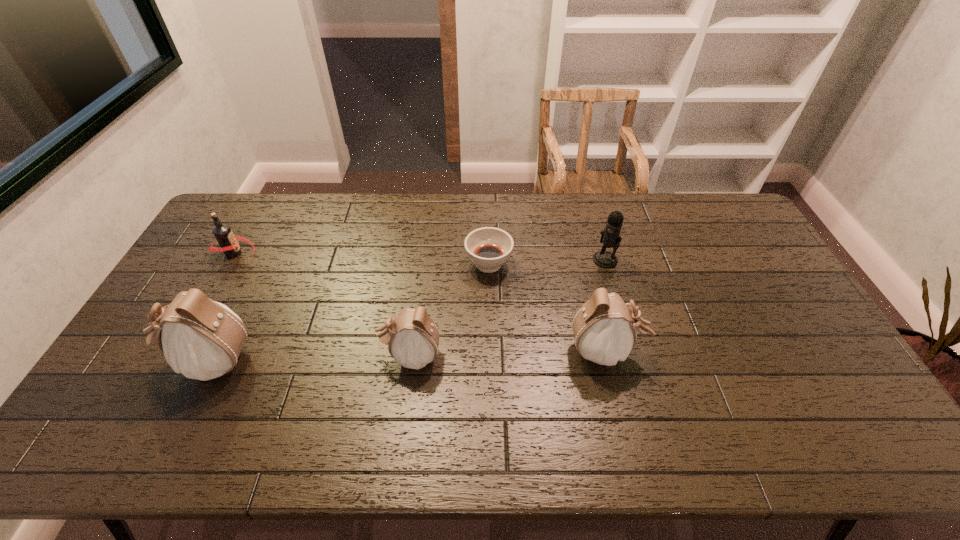
Image resolution: width=960 pixels, height=540 pixels. What are the coordinates of `vacant area situated on the front-facing side of the fourth object from right to left` in the screenshot? It's located at (258, 356).

Find the location of `free space located 0.180m on the front-facing side of the fourth object from right to left`. free space located 0.180m on the front-facing side of the fourth object from right to left is located at coordinates (313, 356).

This screenshot has height=540, width=960. Identify the location of vacant space positioned on the front-facing side of the fourth object from right to left. (266, 356).

Locate an element on the screen. The width and height of the screenshot is (960, 540). blank space located on the front-facing side of the second shortest pouch is located at coordinates (705, 351).

This screenshot has width=960, height=540. In order to click on vacant space located 0.100m on the front of the microphone in this screenshot , I will do `click(613, 291)`.

Identify the location of blank space located on the right of the shortest object. (579, 264).

Find the location of a particular element. Image resolution: width=960 pixels, height=540 pixels. vacant region located on the label of the root beer is located at coordinates (286, 253).

Where is `object that is positioned at the near edge`? This screenshot has width=960, height=540. object that is positioned at the near edge is located at coordinates (202, 339).

Where is `pouch present at the left edge`? This screenshot has height=540, width=960. pouch present at the left edge is located at coordinates (202, 339).

This screenshot has width=960, height=540. What are the coordinates of `root beer that is at the left edge` in the screenshot? It's located at (228, 242).